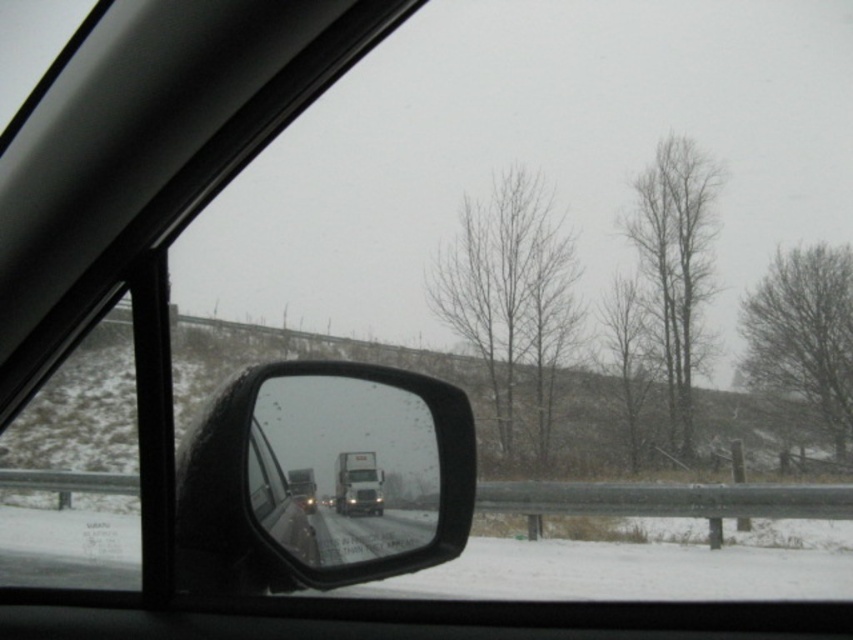
You are driving in a snowy area and need to check your rearview mirror. Where is the black glossy rearview mirror at center located in terms of its 2D coordinates?

The black glossy rearview mirror at center is located at the 2D coordinates of point (321, 477).

You are driving a car and need to check the visibility of your black glossy rearview mirror at center and the white glossy trailer truck at center. Which object has a wider width?

The black glossy rearview mirror at center has a larger width than the white glossy trailer truck at center according to the description.